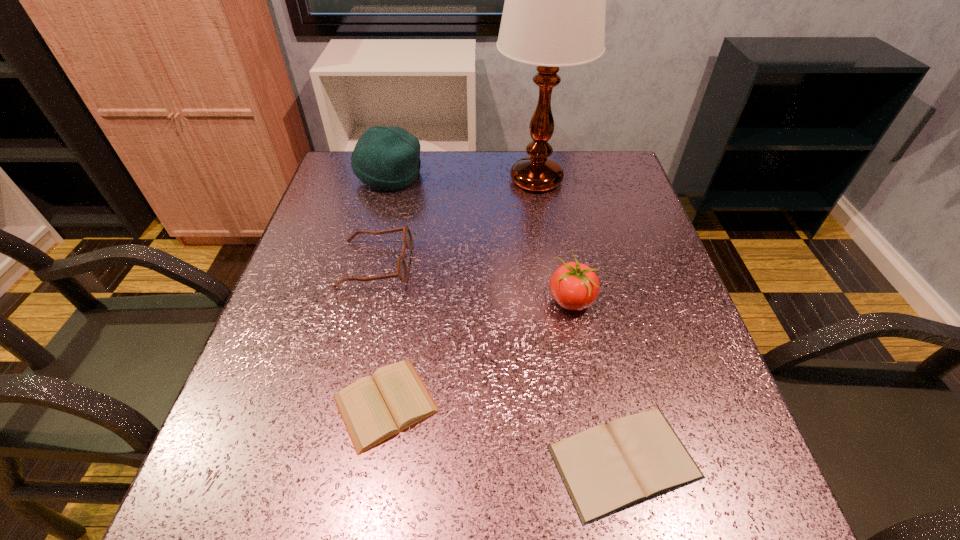
Where is `the tallest object`? This screenshot has width=960, height=540. the tallest object is located at coordinates (554, 12).

You are a GUI agent. You are given a task and a screenshot of the screen. Output one action in this format:
    pyautogui.click(x=<x>, y=<y>)
    Task: Click on the second tallest object
    
    Given the screenshot: What is the action you would take?
    pyautogui.click(x=388, y=158)

You are a GUI agent. You are given a task and a screenshot of the screen. Output one action in this format:
    pyautogui.click(x=<x>, y=<y>)
    Task: Click on the tomato
    The image size is (960, 540).
    Given the screenshot: What is the action you would take?
    coord(574,286)

This screenshot has width=960, height=540. In order to click on the third shortest object in this screenshot , I will do `click(402, 270)`.

You are a GUI agent. You are given a task and a screenshot of the screen. Output one action in this format:
    pyautogui.click(x=<x>, y=<y>)
    Task: Click on the diary
    
    Given the screenshot: What is the action you would take?
    pyautogui.click(x=374, y=409)

I want to click on Bible, so click(606, 469).

Where is `vacant region located on the left of the table lamp`? This screenshot has width=960, height=540. vacant region located on the left of the table lamp is located at coordinates (372, 179).

The width and height of the screenshot is (960, 540). I want to click on vacant space located on the right of the beanie, so click(455, 175).

Locate an element on the screen. This screenshot has height=540, width=960. free space located 0.090m on the front of the fourth shortest object is located at coordinates pos(582,358).

Find the location of a particular element. blank space located 0.070m on the front-facing side of the fourth tallest object is located at coordinates (442, 264).